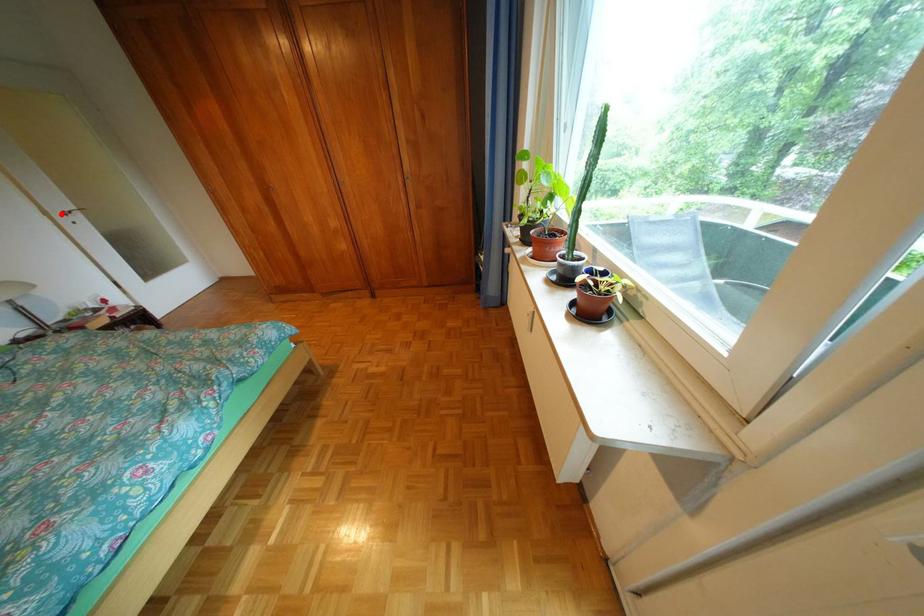
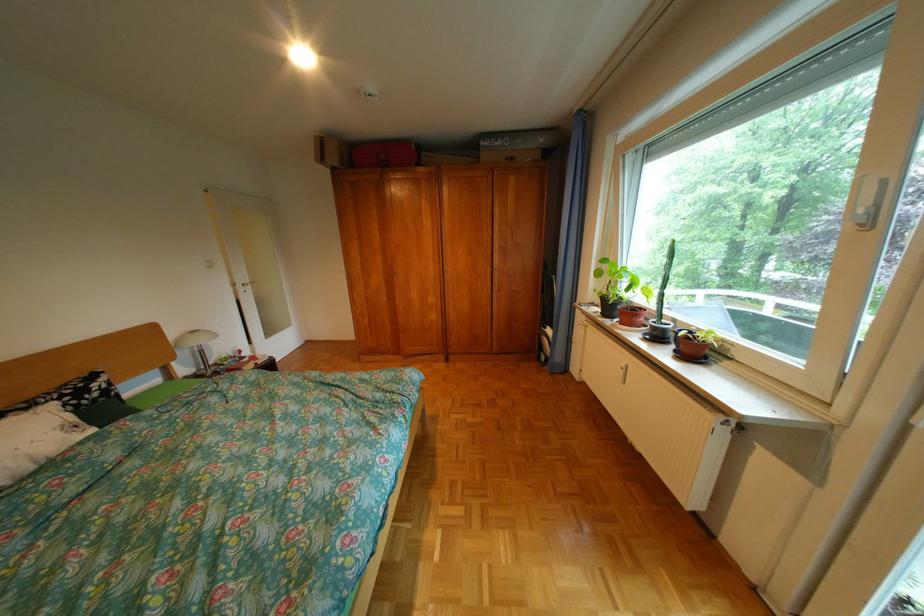
Question: I am providing you with two images of the same scene from different viewpoints. Given a red point in image1, look at the same physical point in image2. Is it:

Choices:
 (A) Closer to the viewpoint
 (B) Farther from the viewpoint

Answer: (A)